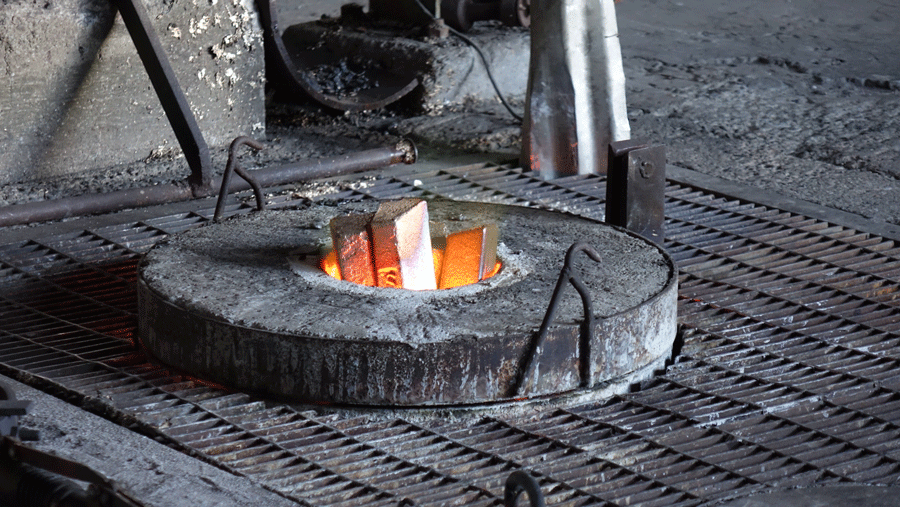
At what (x,y) coordinates should I click in order to perform the action: click on hooks. Please return your answer as a coordinate pair (x, y). The width and height of the screenshot is (900, 507). Looking at the image, I should click on (574, 250), (239, 142).